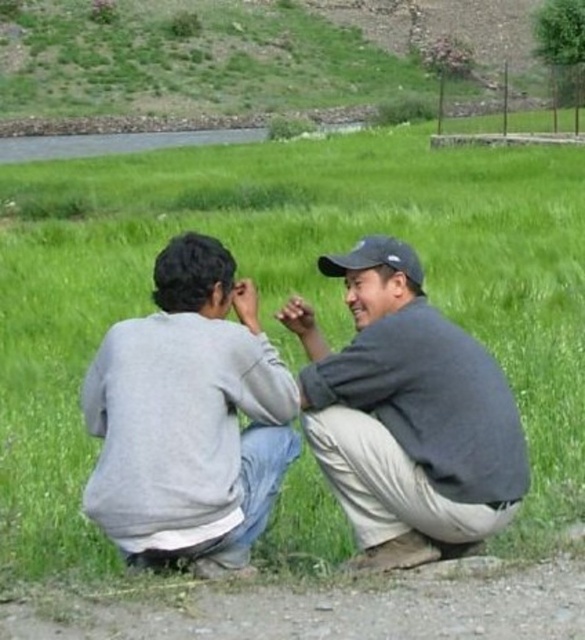
Between gray cotton sweatshirt at center and black fabric baseball cap at center, which one is positioned lower?

gray cotton sweatshirt at center is lower down.

Can you confirm if gray cotton sweatshirt at center is smaller than black fabric baseball cap at center?

Yes.

I want to click on gray cotton sweatshirt at center, so click(188, 417).

Locate an element on the screen. This screenshot has height=640, width=585. gray cotton sweatshirt at center is located at coordinates (188, 417).

Which of these two, gray cotton shirt at center or black fabric baseball cap at center, stands shorter?

black fabric baseball cap at center is shorter.

The width and height of the screenshot is (585, 640). I want to click on gray cotton shirt at center, so click(407, 413).

At what (x,y) coordinates should I click in order to perform the action: click on gray cotton shirt at center. Please return your answer as a coordinate pair (x, y). The width and height of the screenshot is (585, 640). Looking at the image, I should click on (407, 413).

Is the position of gray cotton sweatshirt at center less distant than that of gray cotton shirt at center?

Yes.

Between point (132, 365) and point (402, 273), which one is positioned behind?

The point (402, 273) is more distant.

Does point (178, 406) come closer to viewer compared to point (367, 544)?

Yes, point (178, 406) is in front of point (367, 544).

Image resolution: width=585 pixels, height=640 pixels. I want to click on gray cotton sweatshirt at center, so click(x=188, y=417).